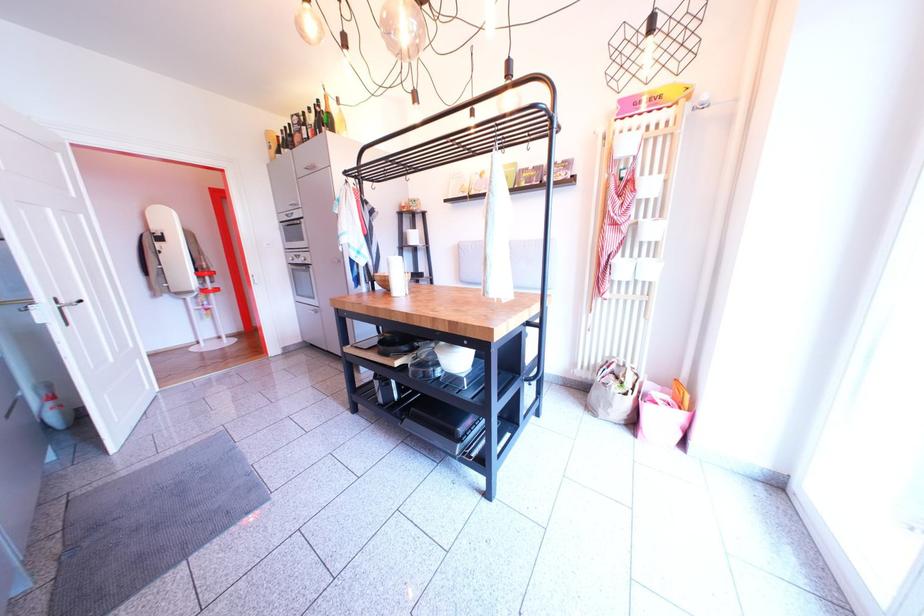
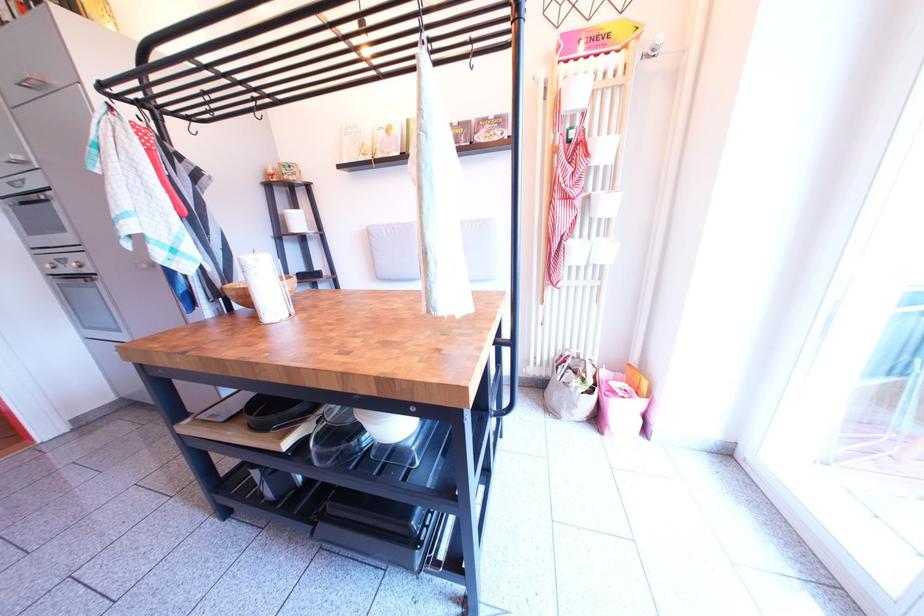
The point at (x=309, y=262) is marked in the first image. Where is the corresponding point in the second image?

(74, 267)